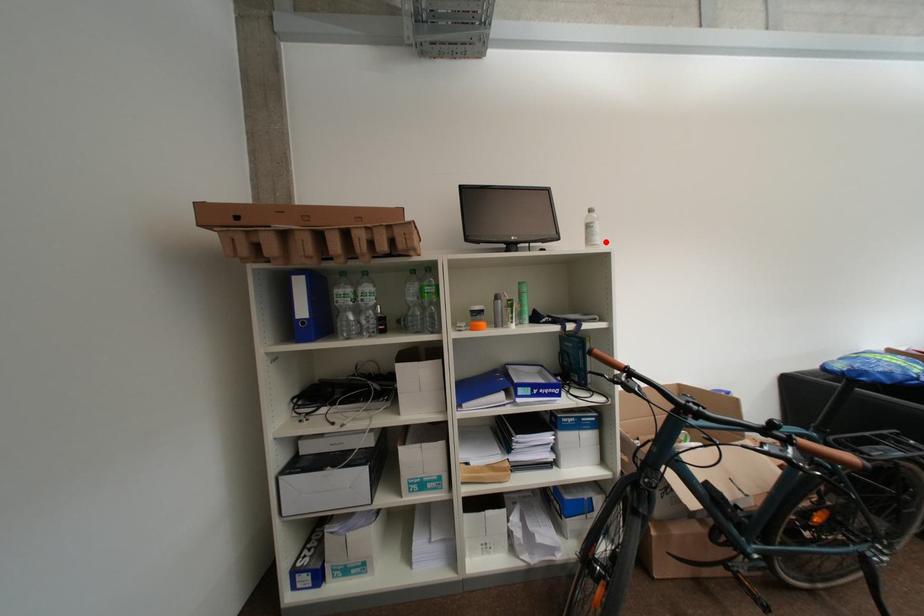
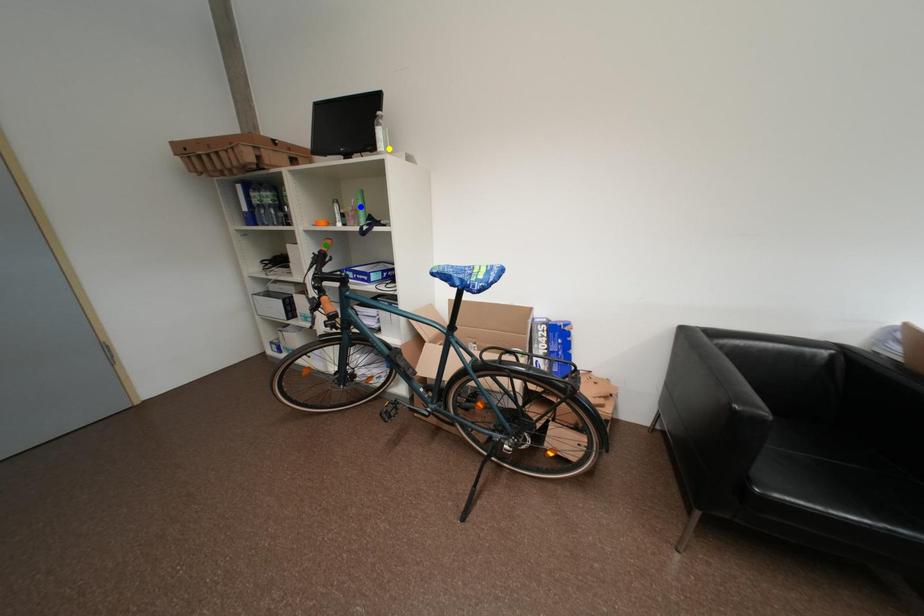
Question: I am providing you with two images of the same scene from different viewpoints. A red point is marked on the first image. You are given multiple points on the second image. Which spot in image 2 lines up with the point in image 1?

Choices:
 (A) yellow point
 (B) green point
 (C) blue point

Answer: (A)